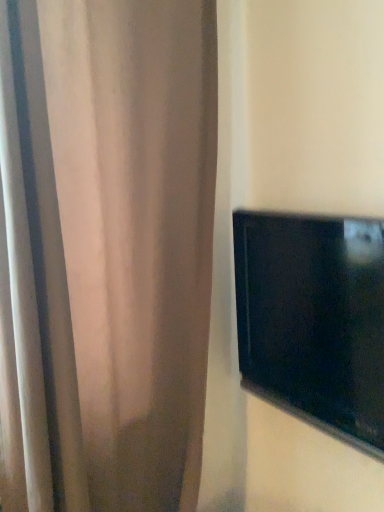
Question: Should I look upward or downward to see black glossy tv at right?

Choices:
 (A) down
 (B) up

Answer: (A)